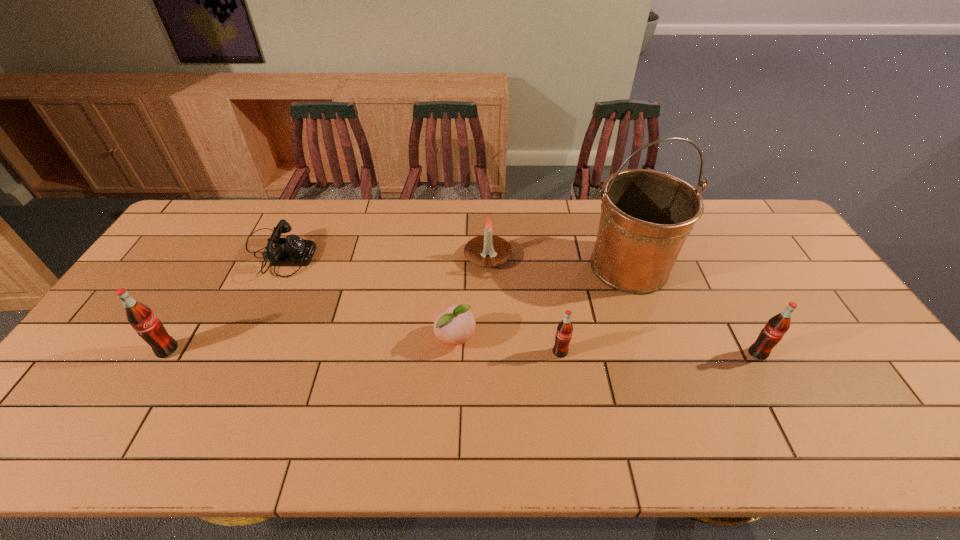
Locate an element on the screen. This screenshot has width=960, height=540. free space between the leftmost soda bottle and the rightmost soda bottle is located at coordinates (463, 352).

Image resolution: width=960 pixels, height=540 pixels. Identify the location of vacant area between the leftmost soda bottle and the tallest object. (398, 308).

Find the location of a particular element. blank region between the candle and the sixth object from right to left is located at coordinates (382, 255).

Identify the location of empty space that is in between the rightmost soda bottle and the leftmost soda bottle. (463, 352).

Locate an element on the screen. The width and height of the screenshot is (960, 540). free space between the sixth object from left to right and the second tallest soda bottle is located at coordinates (693, 310).

Locate an element on the screen. free space between the tallest object and the candle is located at coordinates (559, 262).

Where is `object that is the closest to the candle`? The width and height of the screenshot is (960, 540). object that is the closest to the candle is located at coordinates (456, 326).

At what (x,y) coordinates should I click in order to perform the action: click on the fourth closest object to the second object from left to right. Please return your answer as a coordinate pair (x, y). This screenshot has height=540, width=960. Looking at the image, I should click on (563, 336).

In order to click on soda bottle identified as the second closest to the leftmost soda bottle in this screenshot , I will do 778,325.

Locate an element on the screen. Image resolution: width=960 pixels, height=540 pixels. soda bottle that is the third nearest to the tallest object is located at coordinates (143, 320).